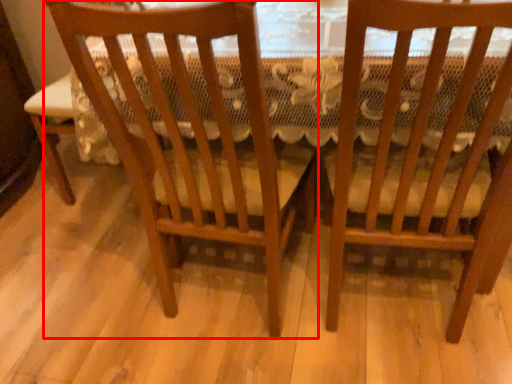
Question: From the image's perspective, what is the correct spatial positioning of chair (annotated by the red box) in reference to chair?

Choices:
 (A) above
 (B) below

Answer: (A)